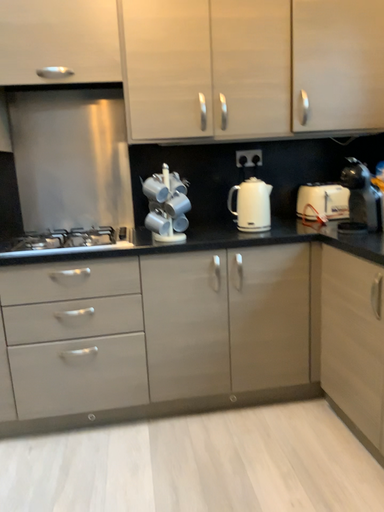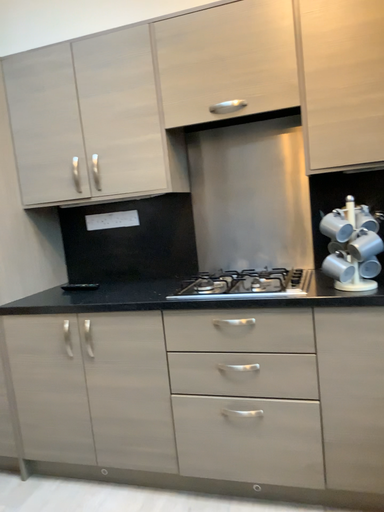
Question: How did the camera likely rotate when shooting the video?

Choices:
 (A) rotated left
 (B) rotated right

Answer: (A)